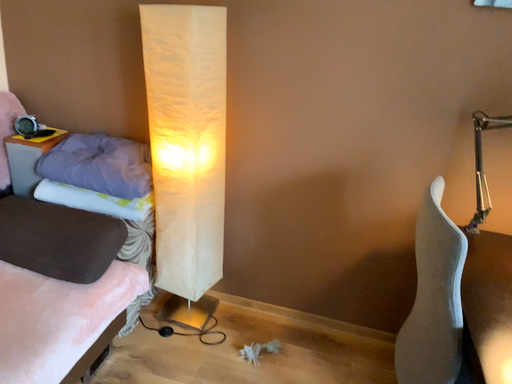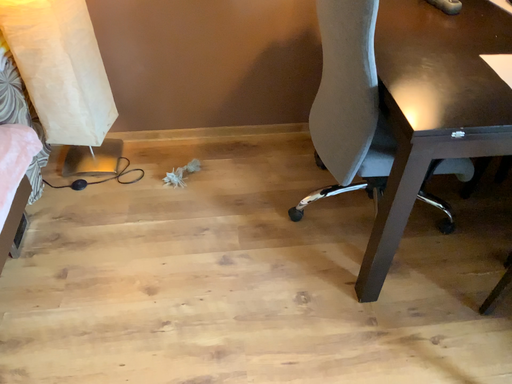
Question: How did the camera likely rotate when shooting the video?

Choices:
 (A) rotated downward
 (B) rotated upward

Answer: (A)